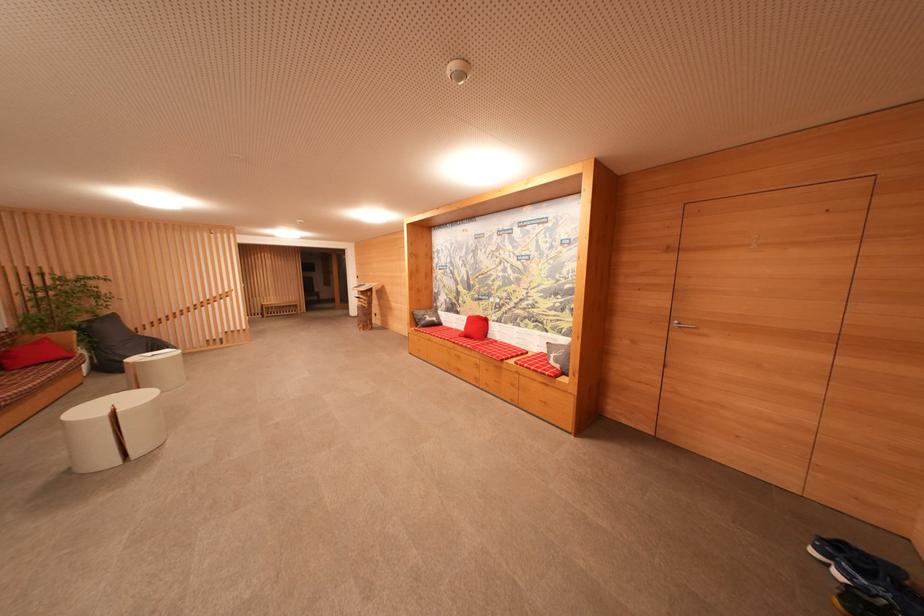
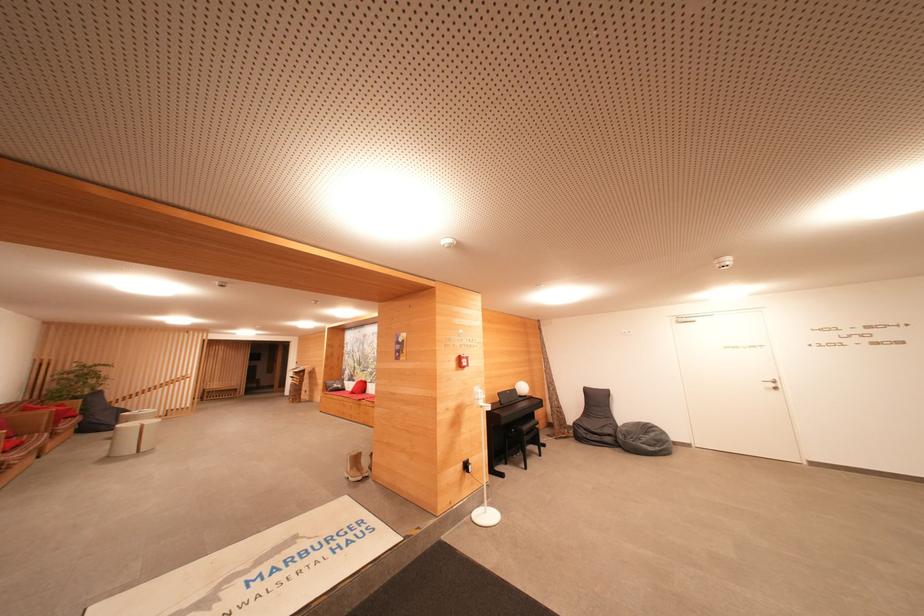
Find the pixel in the second image that matches point 117,320 in the first image.

(103, 395)